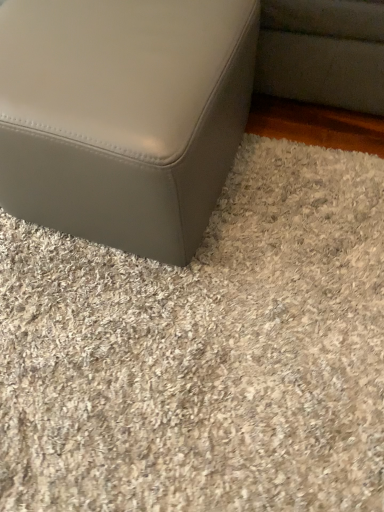
Question: Could you tell me if matte gray ottoman at lower left is turned towards matte gray ottoman at lower left?

Choices:
 (A) no
 (B) yes

Answer: (B)

Question: From the image's perspective, is matte gray ottoman at lower left located above matte gray ottoman at lower left?

Choices:
 (A) no
 (B) yes

Answer: (B)

Question: Can you confirm if matte gray ottoman at lower left is positioned to the left of matte gray ottoman at lower left?

Choices:
 (A) yes
 (B) no

Answer: (A)

Question: From a real-world perspective, is matte gray ottoman at lower left over matte gray ottoman at lower left?

Choices:
 (A) no
 (B) yes

Answer: (B)

Question: Is matte gray ottoman at lower left surrounding matte gray ottoman at lower left?

Choices:
 (A) no
 (B) yes

Answer: (A)

Question: Is matte gray ottoman at lower left wider than matte gray ottoman at lower left?

Choices:
 (A) no
 (B) yes

Answer: (A)

Question: Is matte gray ottoman at lower left shorter than matte gray ottoman at lower left?

Choices:
 (A) yes
 (B) no

Answer: (A)

Question: Is matte gray ottoman at lower left positioned before matte gray ottoman at lower left?

Choices:
 (A) yes
 (B) no

Answer: (B)

Question: Does matte gray ottoman at lower left have a greater width compared to matte gray ottoman at lower left?

Choices:
 (A) yes
 (B) no

Answer: (A)

Question: Can you confirm if matte gray ottoman at lower left is positioned to the right of matte gray ottoman at lower left?

Choices:
 (A) no
 (B) yes

Answer: (B)

Question: Is matte gray ottoman at lower left behind matte gray ottoman at lower left?

Choices:
 (A) no
 (B) yes

Answer: (B)

Question: Is matte gray ottoman at lower left taller than matte gray ottoman at lower left?

Choices:
 (A) no
 (B) yes

Answer: (A)

Question: Is matte gray ottoman at lower left situated inside matte gray ottoman at lower left or outside?

Choices:
 (A) outside
 (B) inside

Answer: (A)